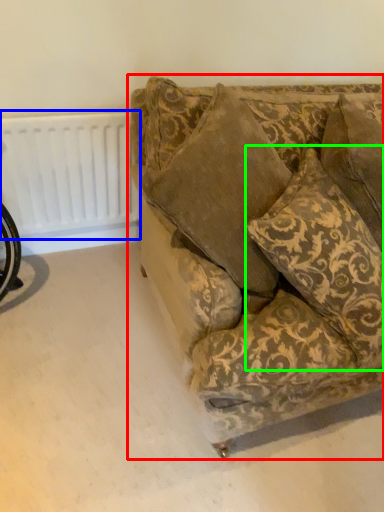
Question: Considering the real-world distances, which object is closest to studio couch (highlighted by a red box)? radiator (highlighted by a blue box) or throw pillow (highlighted by a green box).

Choices:
 (A) radiator
 (B) throw pillow

Answer: (B)